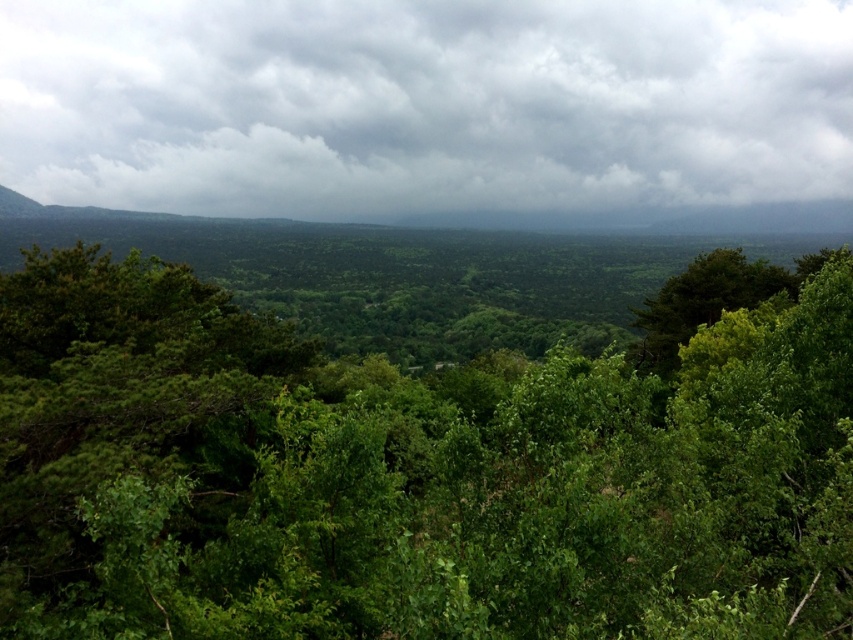
Question: Among these points, which one is farthest from the camera?

Choices:
 (A) coord(695,316)
 (B) coord(686,193)
 (C) coord(181,529)

Answer: (B)

Question: Is gray fluffy cloud at upper center to the right of green leafy tree at right from the viewer's perspective?

Choices:
 (A) yes
 (B) no

Answer: (B)

Question: Does gray fluffy cloud at upper center appear on the left side of green leafy tree at right?

Choices:
 (A) no
 (B) yes

Answer: (B)

Question: Which object is farther from the camera taking this photo?

Choices:
 (A) green leafy tree at center
 (B) green leafy tree at right

Answer: (B)

Question: Which of the following is the farthest from the observer?

Choices:
 (A) green leafy tree at right
 (B) gray fluffy cloud at upper center
 (C) green leafy tree at center

Answer: (B)

Question: Observing the image, what is the correct spatial positioning of green leafy tree at center in reference to green leafy tree at right?

Choices:
 (A) above
 (B) below

Answer: (B)